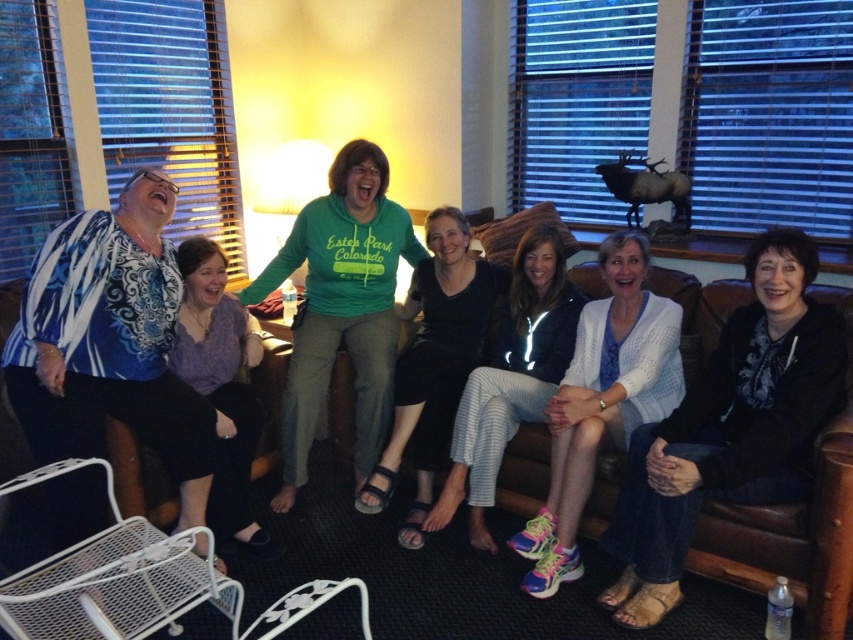
You are a fashion designer observing the scene. You need to decide which pair of pants would be more suitable for a tight fitting outfit. Which one between the black cotton pants at center and the white striped pants at center should you choose?

The black cotton pants at center is thinner than the white striped pants at center, so it would be more suitable for a tight fitting outfit.

You are a tailor measuring the distance between two pairs of pants to ensure proper storage. The black cotton pants at center and white striped pants at center are part of a collection you need to organize. Given that your storage compartment allows for a minimum of 10 inches between items for easy access, can these two pairs be placed side by side without violating the storage guidelines?

The distance between the black cotton pants at center and white striped pants at center is 9.46 inches, which is less than the required 10 inches. Therefore, placing them side by side would violate the storage guidelines.